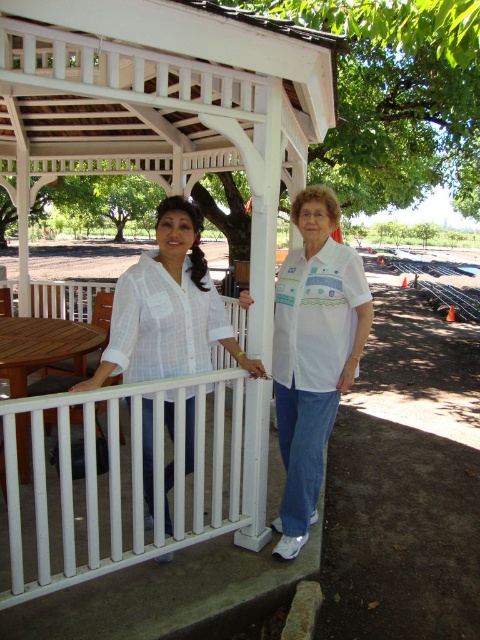
Does point (296, 406) come farther from viewer compared to point (168, 202)?

Yes, it is behind point (168, 202).

Does white cotton shirt at center lie behind white woven blouse at center?

Yes, white cotton shirt at center is behind white woven blouse at center.

What do you see at coordinates (313, 353) in the screenshot? This screenshot has height=640, width=480. I see `white cotton shirt at center` at bounding box center [313, 353].

Locate an element on the screen. Image resolution: width=480 pixels, height=640 pixels. white cotton shirt at center is located at coordinates (313, 353).